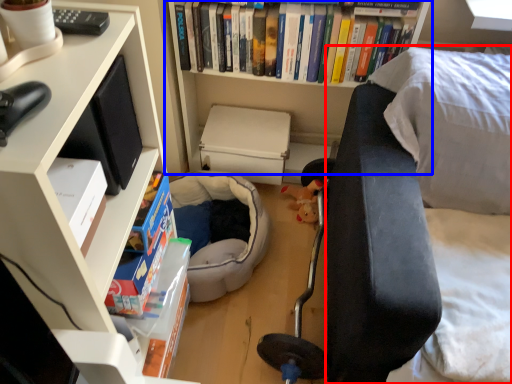
Question: Which object is further to the camera taking this photo, couch (highlighted by a red box) or bookcase (highlighted by a blue box)?

Choices:
 (A) couch
 (B) bookcase

Answer: (B)